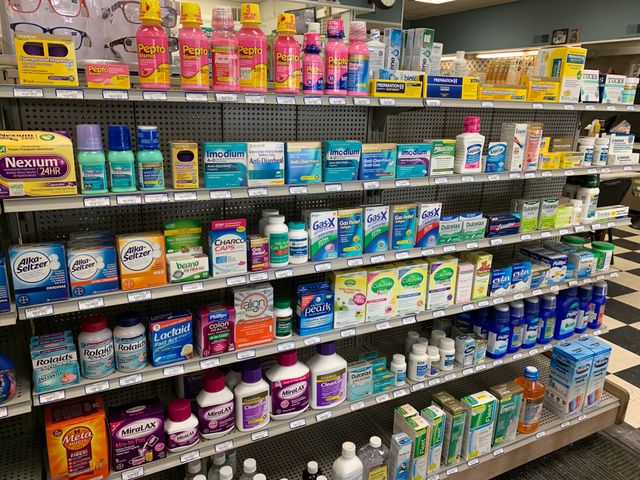
Where is `fluorescent light`? The height and width of the screenshot is (480, 640). fluorescent light is located at coordinates (488, 56), (445, 57).